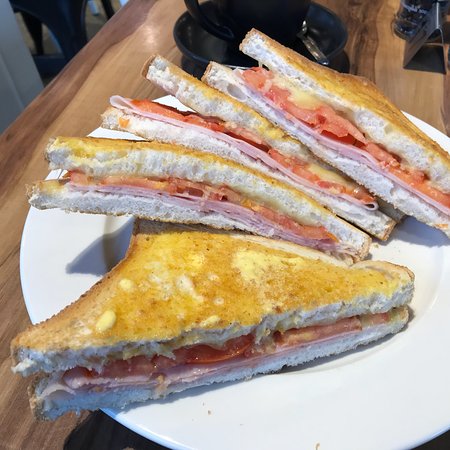
Identify the location of floor under table. The width and height of the screenshot is (450, 450). (95, 24).